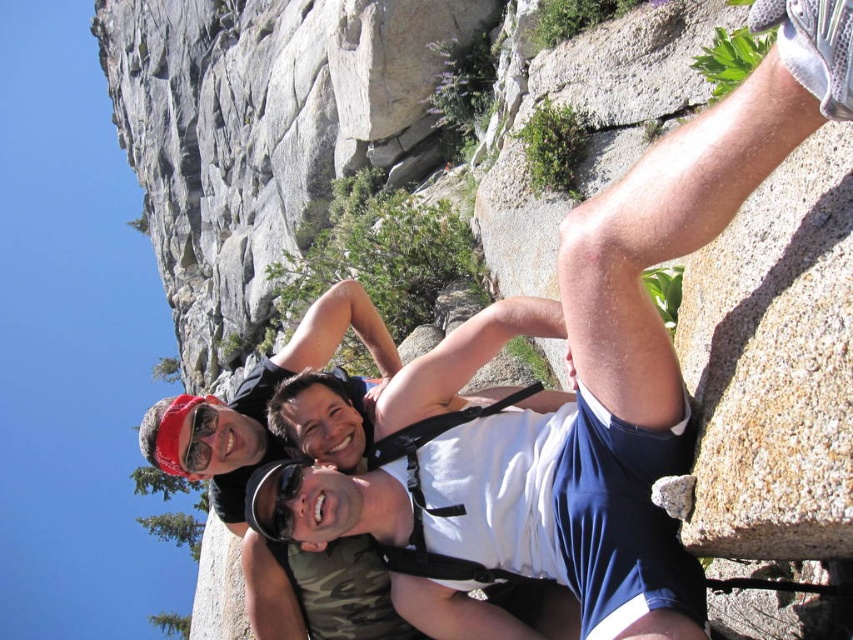
Question: Is white fabric shirt at center smaller than black plastic goggles at center?

Choices:
 (A) no
 (B) yes

Answer: (A)

Question: Can you confirm if white fabric shirt at center is positioned above black plastic goggles at center?

Choices:
 (A) yes
 (B) no

Answer: (A)

Question: Can you confirm if white fabric shirt at center is positioned above black plastic goggles at center?

Choices:
 (A) no
 (B) yes

Answer: (B)

Question: Which point appears closest to the camera in this image?

Choices:
 (A) (271, 532)
 (B) (782, 74)

Answer: (B)